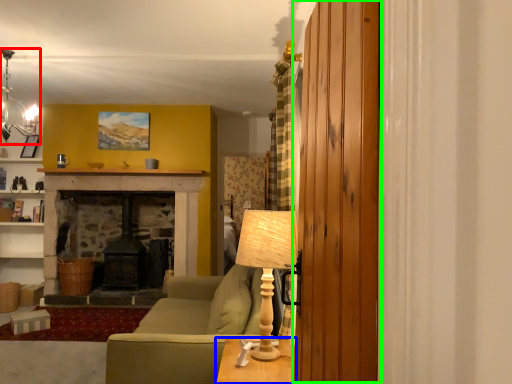
Question: Considering the real-world distances, which object is closest to lamp (highlighted by a red box)? table (highlighted by a blue box) or barn door (highlighted by a green box).

Choices:
 (A) table
 (B) barn door

Answer: (A)